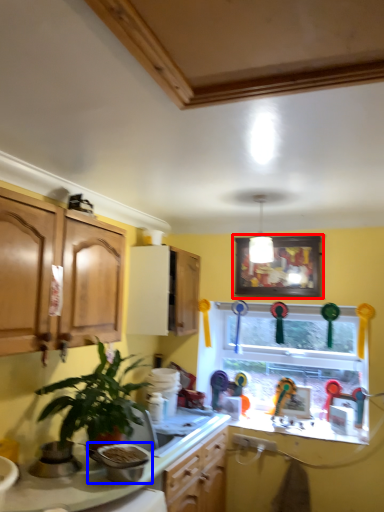
Question: Which point is closer to the camera, picture frame (highlighted by a red box) or appliance (highlighted by a blue box)?

Choices:
 (A) picture frame
 (B) appliance

Answer: (B)